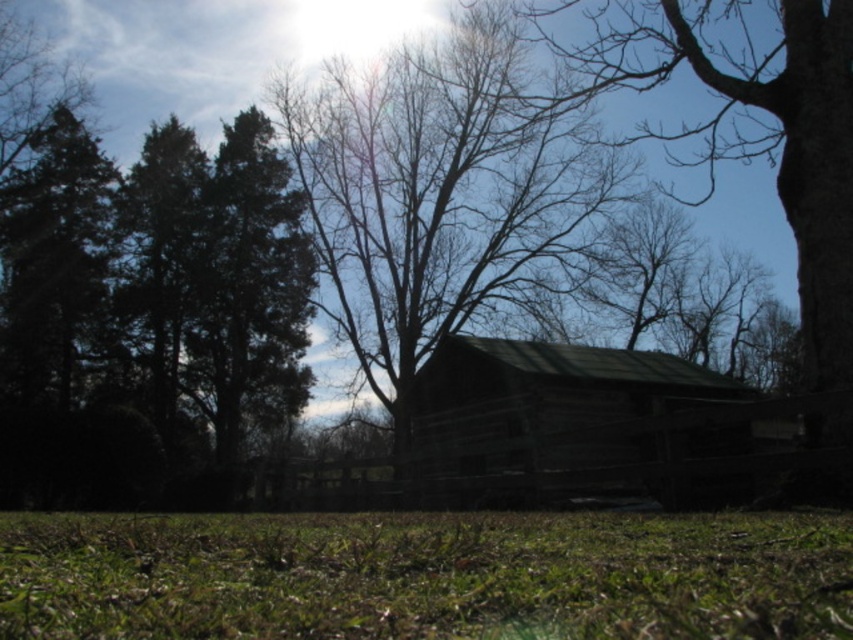
Question: Is green grassy at lower center to the left of dark brown wooden barn at center from the viewer's perspective?

Choices:
 (A) no
 (B) yes

Answer: (B)

Question: Among these points, which one is farthest from the camera?

Choices:
 (A) (302, 636)
 (B) (480, 449)

Answer: (B)

Question: Which of these objects is positioned closest to the green grassy at lower center?

Choices:
 (A) brown wood tree at center
 (B) dark brown wooden barn at center

Answer: (B)

Question: In this image, where is green grassy at lower center located relative to dark brown wooden barn at center?

Choices:
 (A) right
 (B) left

Answer: (B)

Question: Is green grassy at lower center positioned behind dark brown wooden barn at center?

Choices:
 (A) no
 (B) yes

Answer: (A)

Question: Estimate the real-world distances between objects in this image. Which object is farther from the dark brown wooden barn at center?

Choices:
 (A) green grassy at lower center
 (B) brown wood tree at center

Answer: (A)